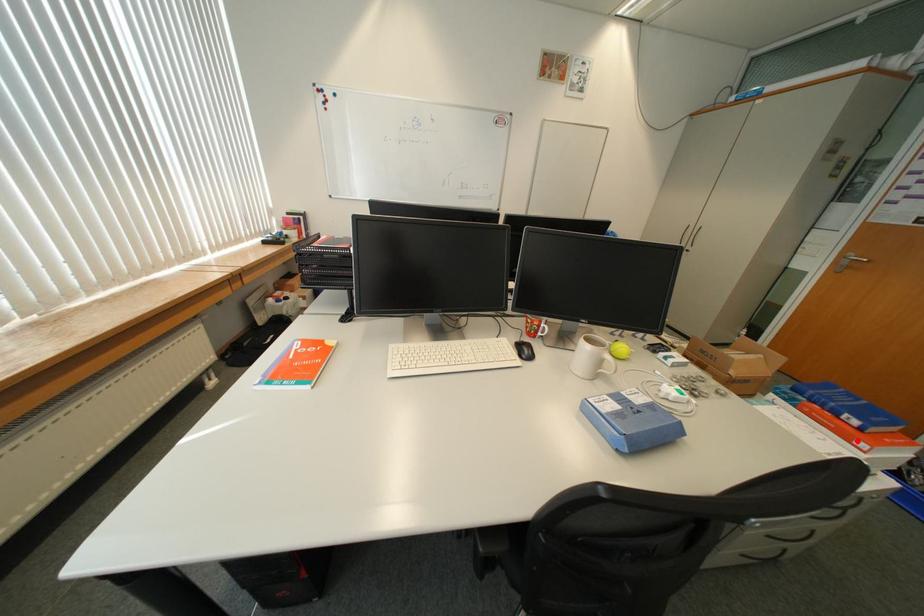
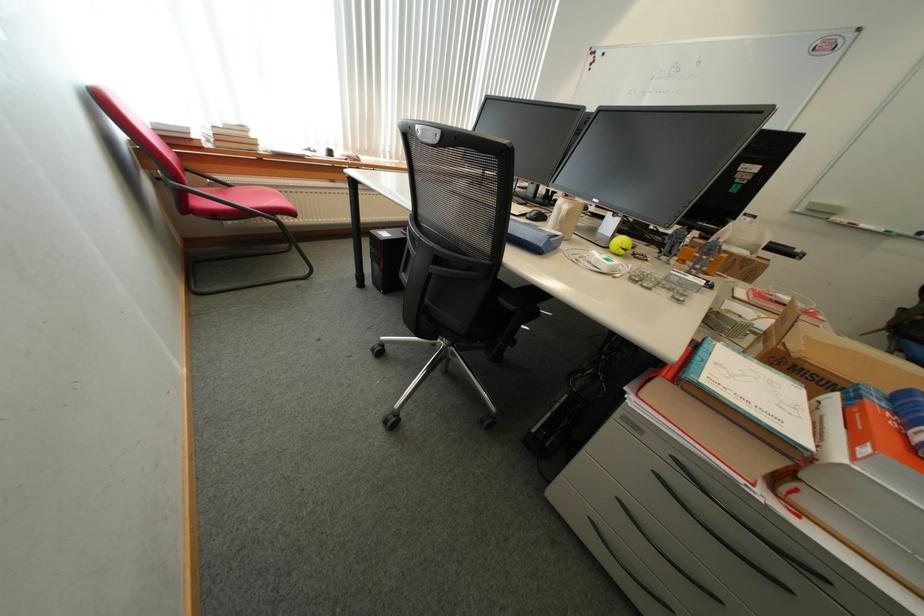
Question: A red point is marked in image1. In image2, is the corresponding 3D point closer to the camera or farther? Reply with the corresponding letter.

Choices:
 (A) The corresponding 3D point is closer.
 (B) The corresponding 3D point is farther.

Answer: (B)